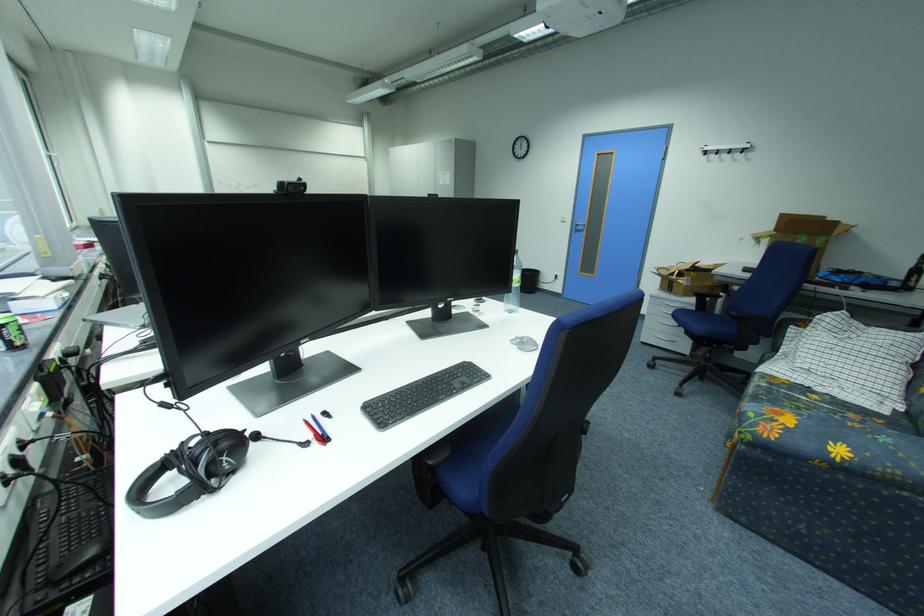
This screenshot has height=616, width=924. Describe the element at coordinates (663, 341) in the screenshot. I see `a drawer handle` at that location.